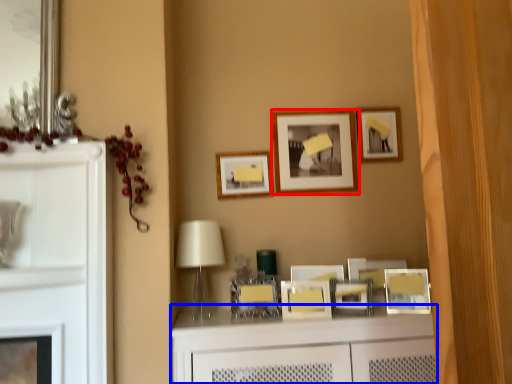
Question: Which of the following is the farthest to the observer, picture frame (highlighted by a red box) or vanity (highlighted by a blue box)?

Choices:
 (A) picture frame
 (B) vanity

Answer: (A)